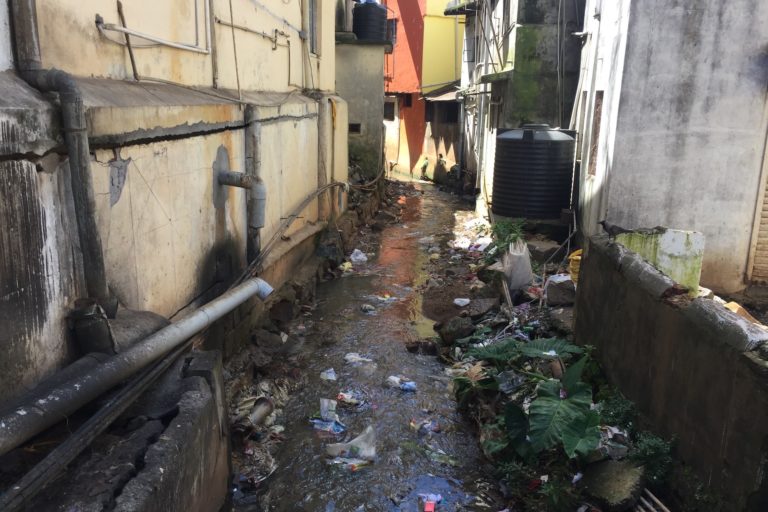
Locate an element on the screen. yellow wall is located at coordinates (444, 40).